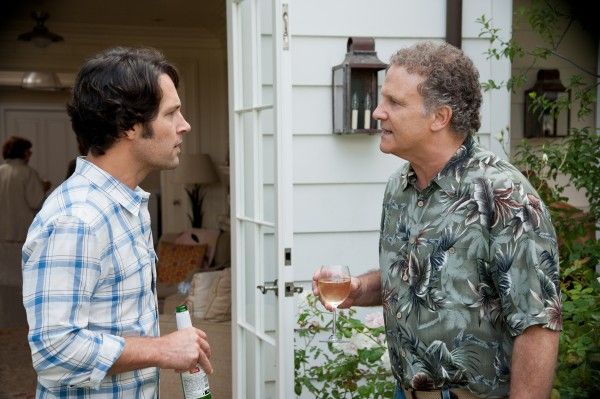
The height and width of the screenshot is (399, 600). Identify the location of wine in wine glass. (341, 285).